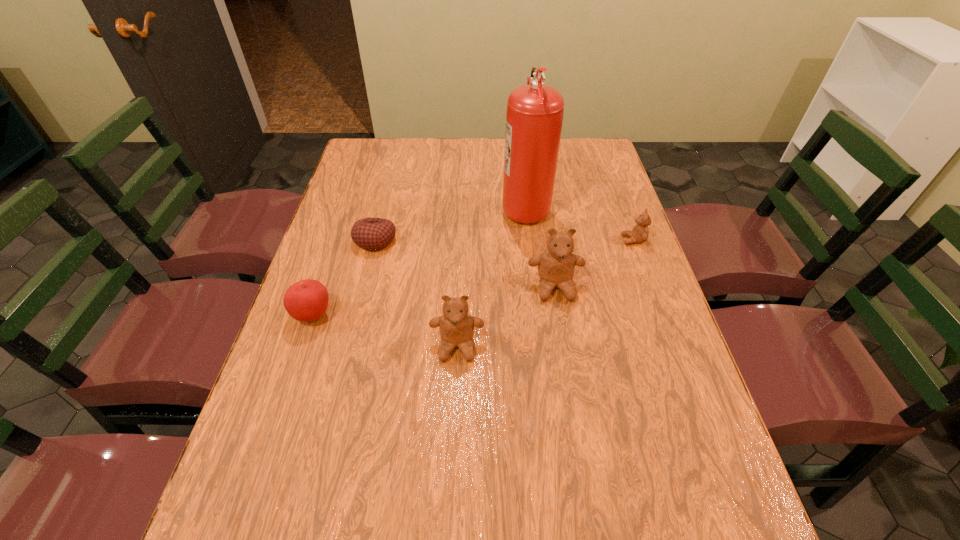
Find the location of a particular element. The height and width of the screenshot is (540, 960). the third object from left to right is located at coordinates 456,326.

Locate an element on the screen. The height and width of the screenshot is (540, 960). the leftmost teddy bear is located at coordinates (456, 326).

Locate an element on the screen. This screenshot has height=540, width=960. the second teddy bear from left to right is located at coordinates (556, 266).

I want to click on the rightmost object, so click(639, 234).

Find the location of a particular element. the shortest teddy bear is located at coordinates (639, 234).

Locate an element on the screen. the tallest object is located at coordinates (534, 116).

The image size is (960, 540). What are the coordinates of `beanbag` in the screenshot? It's located at (373, 234).

Locate an element on the screen. The height and width of the screenshot is (540, 960). apple is located at coordinates (307, 300).

Where is `vacant space located on the face of the second tallest teddy bear`? The width and height of the screenshot is (960, 540). vacant space located on the face of the second tallest teddy bear is located at coordinates (452, 464).

Where is `free space located 0.360m on the face of the second teddy bear from right to left`? This screenshot has width=960, height=540. free space located 0.360m on the face of the second teddy bear from right to left is located at coordinates (581, 445).